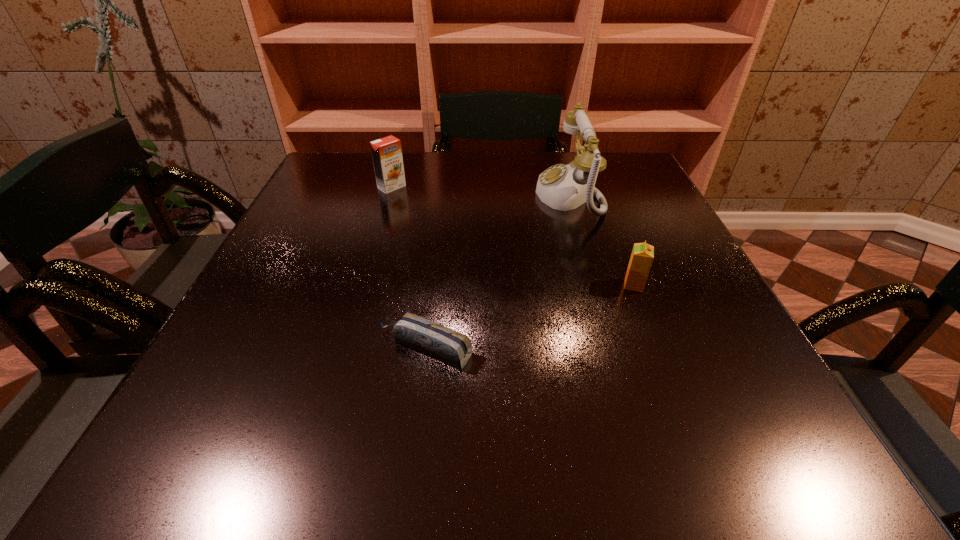
The height and width of the screenshot is (540, 960). Identify the location of the tallest object. (562, 187).

Identify the location of the second tallest object. (387, 157).

The width and height of the screenshot is (960, 540). Find the location of `the farther orange juice`. the farther orange juice is located at coordinates (387, 157).

Where is `the right orange juice`? the right orange juice is located at coordinates (642, 256).

The image size is (960, 540). I want to click on the shorter orange juice, so click(642, 256).

The image size is (960, 540). I want to click on pencil box, so click(444, 344).

Where is `the nearest object`? the nearest object is located at coordinates (444, 344).

In order to click on vacant region located on the dial of the telephone in this screenshot , I will do `click(422, 196)`.

The height and width of the screenshot is (540, 960). Find the location of `vacant area located 0.320m on the dial of the telephone`. vacant area located 0.320m on the dial of the telephone is located at coordinates (406, 196).

Identify the location of free space located on the dial of the telephone. This screenshot has height=540, width=960. (426, 196).